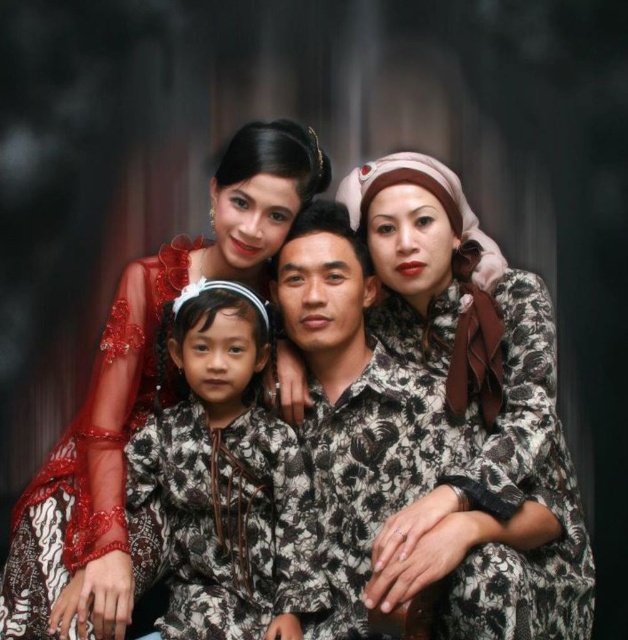
Question: Does matte red sheer fabric at upper left have a smaller size compared to batik-patterned dress at center?

Choices:
 (A) yes
 (B) no

Answer: (B)

Question: Among these objects, which one is farthest from the camera?

Choices:
 (A) printed fabric blouse at center
 (B) matte red sheer fabric at upper left
 (C) batik-patterned dress at center

Answer: (C)

Question: Which is nearer to the matte red sheer fabric at upper left?

Choices:
 (A) printed fabric blouse at center
 (B) batik-patterned dress at center

Answer: (B)

Question: Considering the relative positions of printed fabric blouse at center and batik-patterned dress at center in the image provided, where is printed fabric blouse at center located with respect to batik-patterned dress at center?

Choices:
 (A) right
 (B) left

Answer: (A)

Question: Which of the following is the closest to the observer?

Choices:
 (A) matte red sheer fabric at upper left
 (B) batik-patterned dress at center
 (C) printed fabric blouse at center

Answer: (C)

Question: Observing the image, what is the correct spatial positioning of printed fabric blouse at center in reference to matte red sheer fabric at upper left?

Choices:
 (A) above
 (B) below

Answer: (B)